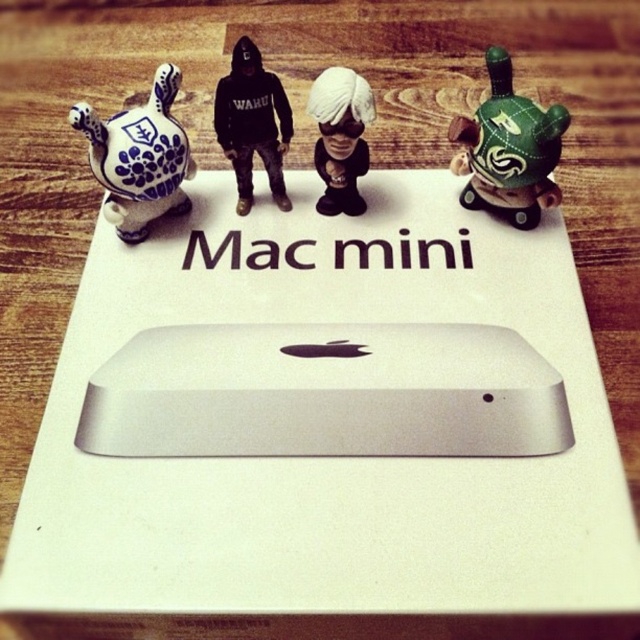
You are organizing items on a desk and need to place a new item between the silver metallic mac mini at center and the white matte figurine at center. Based on their current positions, where should you place the new item?

The silver metallic mac mini at center is to the left of the white matte figurine at center, so you should place the new item between them to the right of the silver metallic mac mini at center and to the left of the white matte figurine at center.